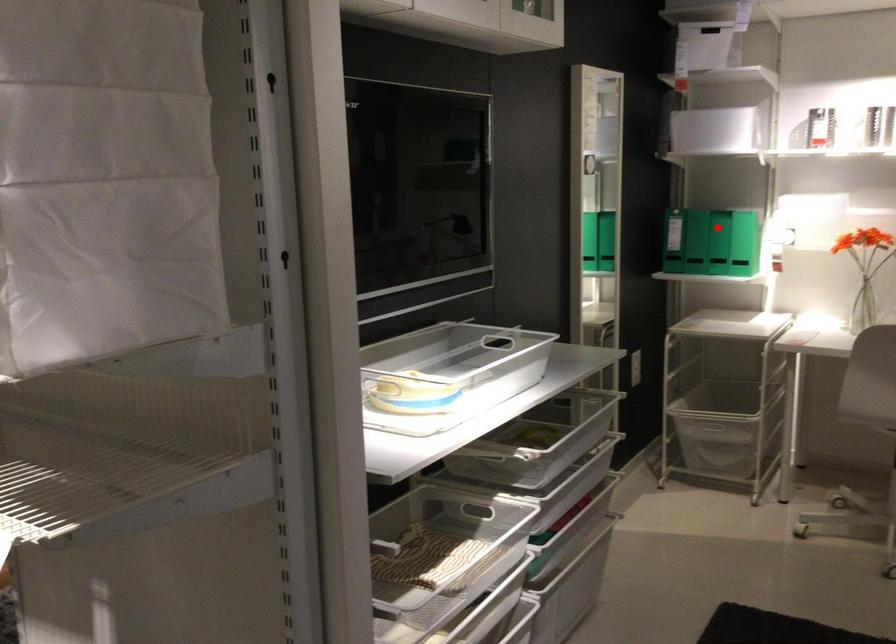
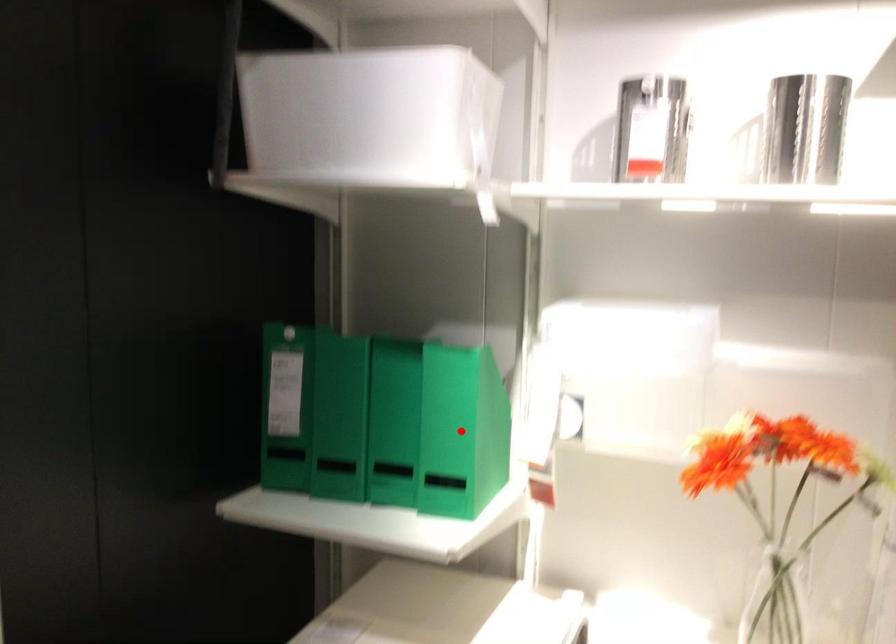
In the scene shown: I am providing you with two images of the same scene from different viewpoints. A red point is marked on the first image and another point is marked on the second image. Are the points marked in image1 and image2 representing the same 3D position?

No